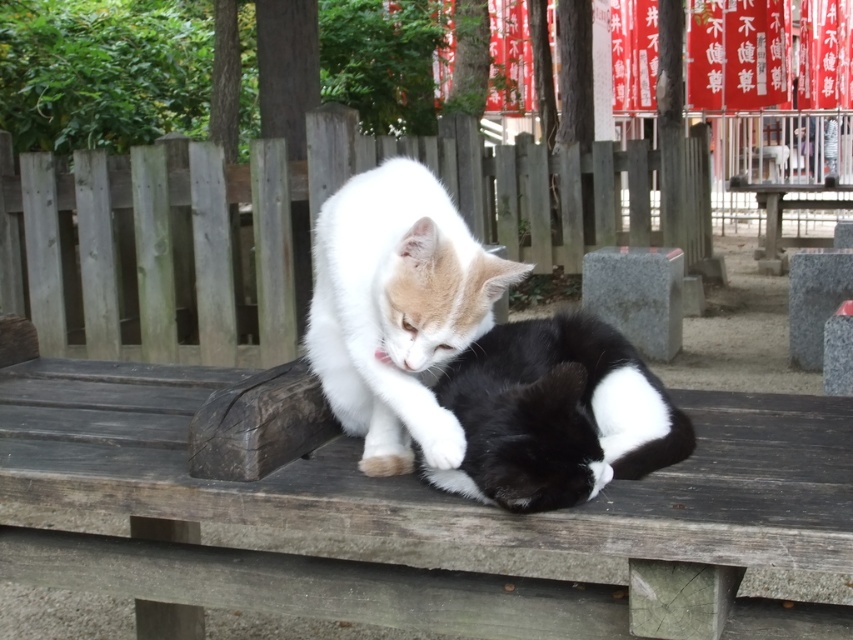
You are a photographer setting up a tripod to capture a photo of the white fluffy cat at center and the wooden picnic table at center. If you want to ensure both subjects are in focus, which one should you adjust the focus on first?

The wooden picnic table at center is taller than the white fluffy cat at center, so you should focus on the wooden picnic table at center first to ensure both are in focus.

You are standing in front of the wooden bench where the two cats are resting. You notice two specific points on the bench marked as point 1 at coordinates point (x=416, y=397) and point 2 at coordinates point (x=521, y=452). If you were to walk towards the bench, which point would you reach first?

Point (x=416, y=397) is further to the viewer than point (x=521, y=452), so you would reach point (x=416, y=397) first as it is closer to you.

You are planning to place a small basket between the black soft fur cat at center and the wooden picnic table at center. Based on their sizes, which object should the basket be closer to?

The black soft fur cat at center is thinner than the wooden picnic table at center, so the basket should be placed closer to the wooden picnic table at center to accommodate its larger size.